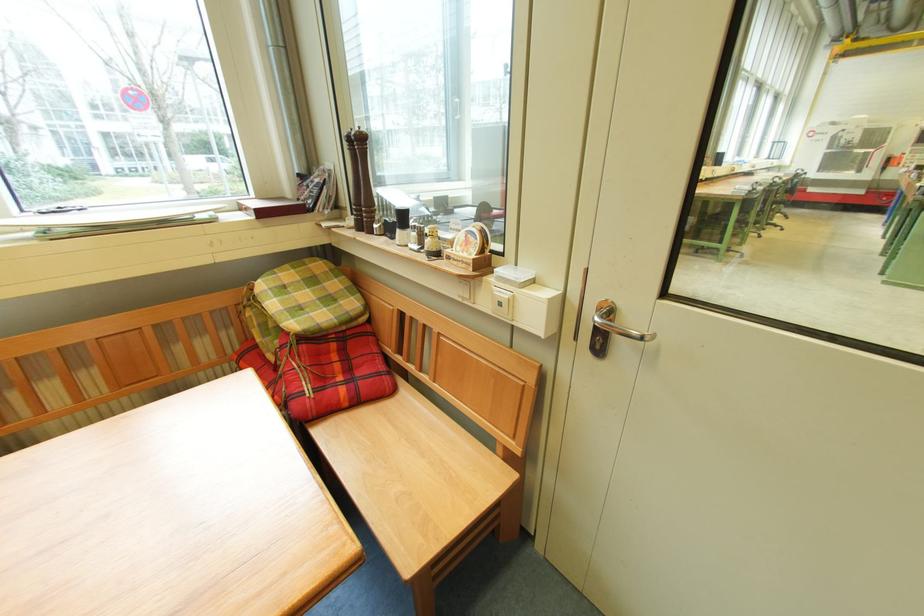
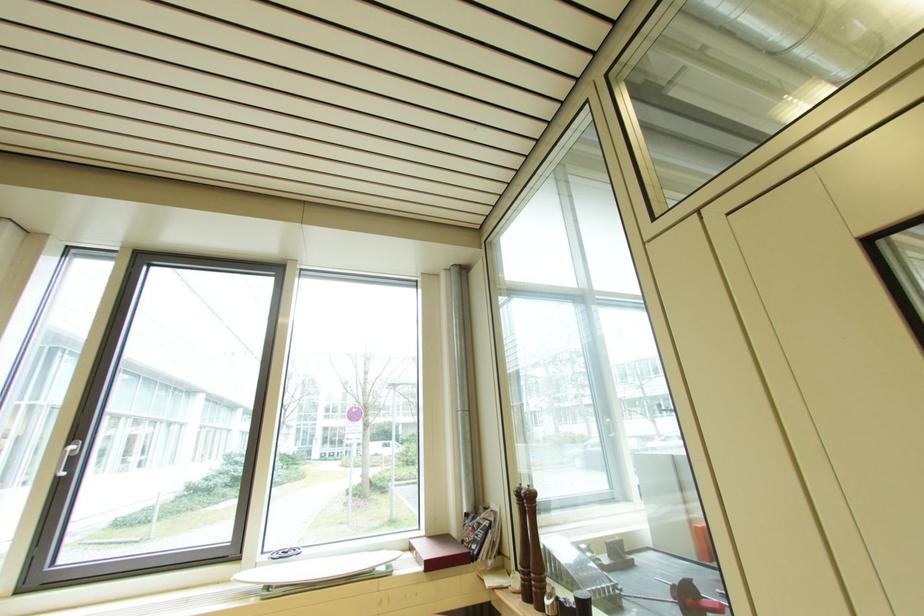
Find the pixel in the second image that matches [383,229] in the first image.

(554, 605)